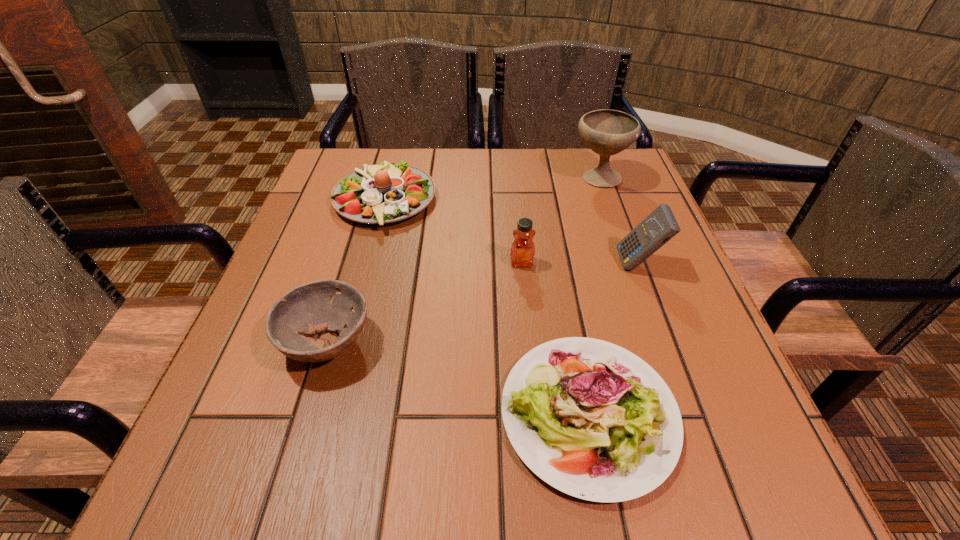
Locate an element on the screen. The width and height of the screenshot is (960, 540). free space between the third tallest object and the calculator is located at coordinates [x=580, y=264].

Identify the location of vacant space that is in between the calculator and the honey. This screenshot has width=960, height=540. (580, 264).

Locate an element on the screen. The width and height of the screenshot is (960, 540). empty space between the calculator and the bowl is located at coordinates pyautogui.click(x=483, y=303).

Image resolution: width=960 pixels, height=540 pixels. In order to click on object that is the third nearest to the chalice in this screenshot , I will do `click(387, 192)`.

Identify the location of object that stands as the second closest to the chalice. The width and height of the screenshot is (960, 540). (522, 253).

Identify the location of vacant space that satisfies the following two spatial constraints: 1. on the front label of the nearer salad plate; 2. on the right side of the fourth shortest object. The height and width of the screenshot is (540, 960). coord(537,414).